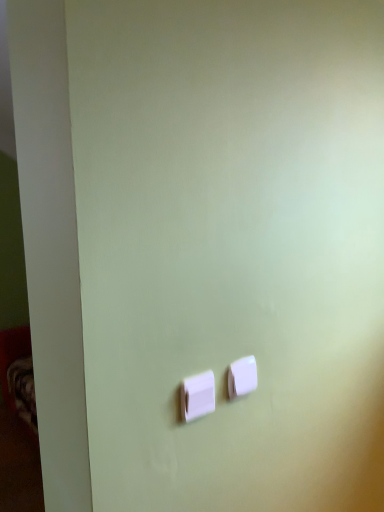
Question: Which direction should I rotate to face white plastic light switch at center, the 1th light switch viewed from the back, — up or down?

Choices:
 (A) up
 (B) down

Answer: (B)

Question: Is white plastic light switch at center, the 1th light switch viewed from the back, surrounded by white plastic light switch at center, which appears as the second light switch when viewed from the back?

Choices:
 (A) yes
 (B) no

Answer: (B)

Question: Does white plastic light switch at center, which appears as the second light switch when viewed from the back, touch white plastic light switch at center, which is the first light switch from right to left?

Choices:
 (A) no
 (B) yes

Answer: (B)

Question: Is white plastic light switch at center, which is the 1th light switch from front to back, shorter than white plastic light switch at center, the 2th light switch in the left-to-right sequence?

Choices:
 (A) no
 (B) yes

Answer: (A)

Question: Considering the relative positions of white plastic light switch at center, which appears as the 2th light switch when viewed from the right, and white plastic light switch at center, the 2th light switch in the left-to-right sequence, in the image provided, is white plastic light switch at center, which appears as the 2th light switch when viewed from the right, to the right of white plastic light switch at center, the 2th light switch in the left-to-right sequence, from the viewer's perspective?

Choices:
 (A) yes
 (B) no

Answer: (B)

Question: Is white plastic light switch at center, which is the first light switch from right to left, at the back of white plastic light switch at center, which appears as the 2th light switch when viewed from the right?

Choices:
 (A) yes
 (B) no

Answer: (B)

Question: Is white plastic light switch at center, which appears as the second light switch when viewed from the back, located outside white plastic light switch at center, the 2th light switch in the left-to-right sequence?

Choices:
 (A) no
 (B) yes

Answer: (B)

Question: Is white plastic light switch at center, marked as the 2th light switch in a front-to-back arrangement, facing away from white plastic light switch at center, which appears as the second light switch when viewed from the back?

Choices:
 (A) no
 (B) yes

Answer: (A)

Question: Considering the relative sizes of white plastic light switch at center, the 1th light switch viewed from the back, and white plastic light switch at center, which is the 1th light switch from front to back, in the image provided, is white plastic light switch at center, the 1th light switch viewed from the back, thinner than white plastic light switch at center, which is the 1th light switch from front to back,?

Choices:
 (A) yes
 (B) no

Answer: (A)

Question: Is white plastic light switch at center, marked as the 2th light switch in a front-to-back arrangement, further to camera compared to white plastic light switch at center, which is the 1th light switch from front to back?

Choices:
 (A) yes
 (B) no

Answer: (A)

Question: Is white plastic light switch at center, marked as the 1th light switch in a left-to-right arrangement, completely or partially inside white plastic light switch at center, the 2th light switch in the left-to-right sequence?

Choices:
 (A) yes
 (B) no

Answer: (B)

Question: Considering the relative sizes of white plastic light switch at center, marked as the 2th light switch in a front-to-back arrangement, and white plastic light switch at center, which is the 1th light switch from front to back, in the image provided, is white plastic light switch at center, marked as the 2th light switch in a front-to-back arrangement, smaller than white plastic light switch at center, which is the 1th light switch from front to back,?

Choices:
 (A) yes
 (B) no

Answer: (A)

Question: Are white plastic light switch at center, the 1th light switch viewed from the back, and white plastic light switch at center, which appears as the second light switch when viewed from the back, beside each other?

Choices:
 (A) no
 (B) yes

Answer: (B)

Question: Considering the relative positions of white plastic light switch at center, marked as the 2th light switch in a front-to-back arrangement, and white plastic light switch at center, which appears as the second light switch when viewed from the back, in the image provided, is white plastic light switch at center, marked as the 2th light switch in a front-to-back arrangement, to the left or to the right of white plastic light switch at center, which appears as the second light switch when viewed from the back,?

Choices:
 (A) left
 (B) right

Answer: (B)